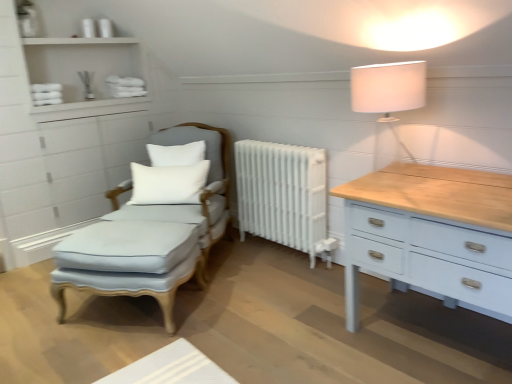
This screenshot has width=512, height=384. I want to click on free location in front of light blue fabric swivel chair at center-left, so (202, 312).